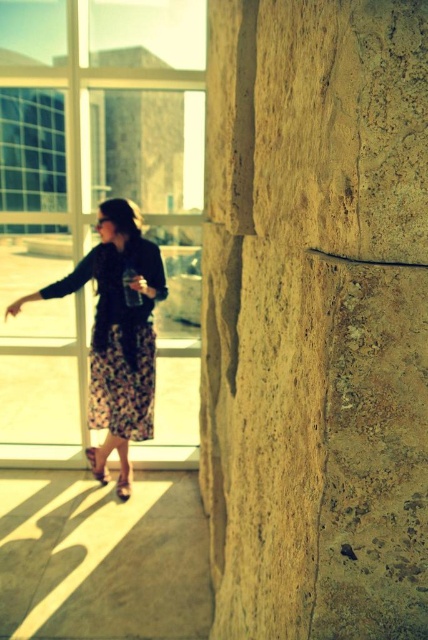
Question: Estimate the real-world distances between objects in this image. Which object is closer to the floral skirt at center?

Choices:
 (A) transparent glass door at upper left
 (B) leather textured sandal at lower center
 (C) beige stone pillar at center
 (D) leather textured sandal at lower left

Answer: (A)

Question: Can you confirm if leather textured sandal at lower left is smaller than leather textured sandal at lower center?

Choices:
 (A) no
 (B) yes

Answer: (A)

Question: Which of the following is the farthest from the observer?

Choices:
 (A) beige stone pillar at center
 (B) transparent glass door at upper left
 (C) floral skirt at center
 (D) leather textured sandal at lower left

Answer: (D)

Question: Can you confirm if beige stone pillar at center is wider than transparent glass door at upper left?

Choices:
 (A) no
 (B) yes

Answer: (A)

Question: Can you confirm if transparent glass door at upper left is smaller than leather textured sandal at lower center?

Choices:
 (A) no
 (B) yes

Answer: (A)

Question: Which object is closer to the camera taking this photo?

Choices:
 (A) beige stone pillar at center
 (B) transparent glass door at upper left

Answer: (A)